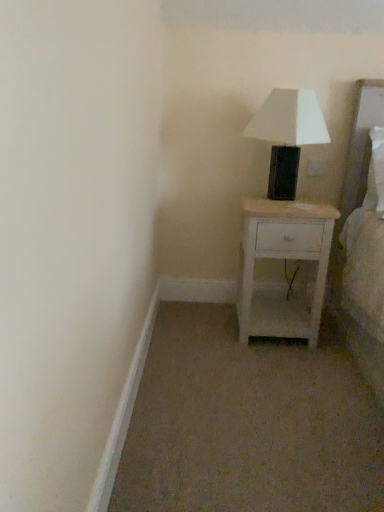
Question: From a real-world perspective, is white matte table lamp at upper right below white wood nightstand at center?

Choices:
 (A) yes
 (B) no

Answer: (B)

Question: Would you say white matte table lamp at upper right is a long distance from white wood nightstand at center?

Choices:
 (A) yes
 (B) no

Answer: (B)

Question: Can you confirm if white matte table lamp at upper right is positioned to the right of white wood nightstand at center?

Choices:
 (A) no
 (B) yes

Answer: (B)

Question: From the image's perspective, is white matte table lamp at upper right beneath white wood nightstand at center?

Choices:
 (A) no
 (B) yes

Answer: (A)

Question: Does white matte table lamp at upper right have a smaller size compared to white wood nightstand at center?

Choices:
 (A) no
 (B) yes

Answer: (B)

Question: Is the position of white matte table lamp at upper right more distant than that of white wood nightstand at center?

Choices:
 (A) no
 (B) yes

Answer: (A)

Question: Is white wood nightstand at center bigger than white matte table lamp at upper right?

Choices:
 (A) yes
 (B) no

Answer: (A)

Question: Does white wood nightstand at center turn towards white matte table lamp at upper right?

Choices:
 (A) no
 (B) yes

Answer: (A)

Question: From a real-world perspective, is white wood nightstand at center positioned under white matte table lamp at upper right based on gravity?

Choices:
 (A) no
 (B) yes

Answer: (B)

Question: Is white wood nightstand at center shorter than white matte table lamp at upper right?

Choices:
 (A) yes
 (B) no

Answer: (B)

Question: Is white wood nightstand at center smaller than white matte table lamp at upper right?

Choices:
 (A) no
 (B) yes

Answer: (A)

Question: Does white wood nightstand at center have a greater height compared to white matte table lamp at upper right?

Choices:
 (A) no
 (B) yes

Answer: (B)

Question: Based on their positions, is white wood nightstand at center located to the left or right of white matte table lamp at upper right?

Choices:
 (A) right
 (B) left

Answer: (B)